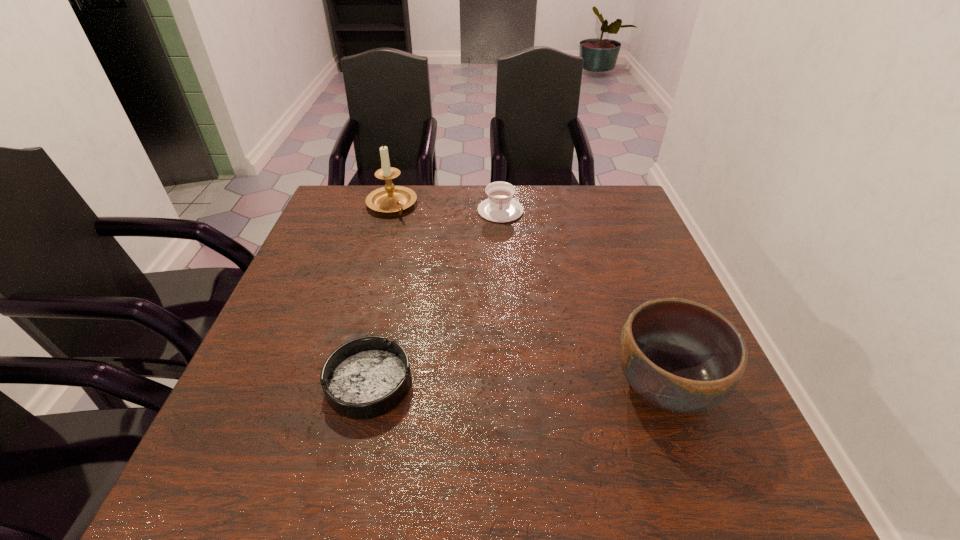
The image size is (960, 540). Identify the location of vacant point that satisfies the following two spatial constraints: 1. on the front side of the tallest object; 2. on the left side of the teacup. (390, 211).

The image size is (960, 540). Find the location of `blank space that satisfies the following two spatial constraints: 1. on the front side of the teacup; 2. on the left side of the candle holder`. blank space that satisfies the following two spatial constraints: 1. on the front side of the teacup; 2. on the left side of the candle holder is located at coordinates (390, 211).

Locate an element on the screen. free spot that satisfies the following two spatial constraints: 1. on the front side of the rightmost object; 2. on the right side of the shortest object is located at coordinates (370, 385).